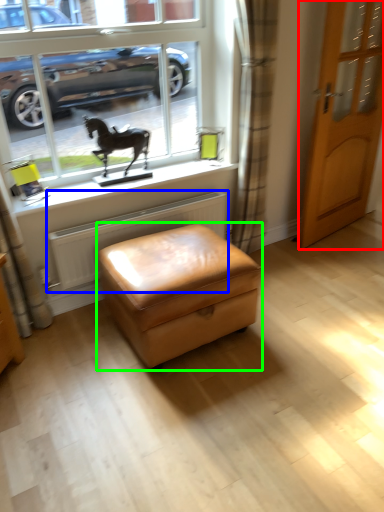
Question: Based on their relative distances, which object is nearer to door (highlighted by a red box)? Choose from radiator (highlighted by a blue box) and stool (highlighted by a green box).

Choices:
 (A) radiator
 (B) stool

Answer: (A)